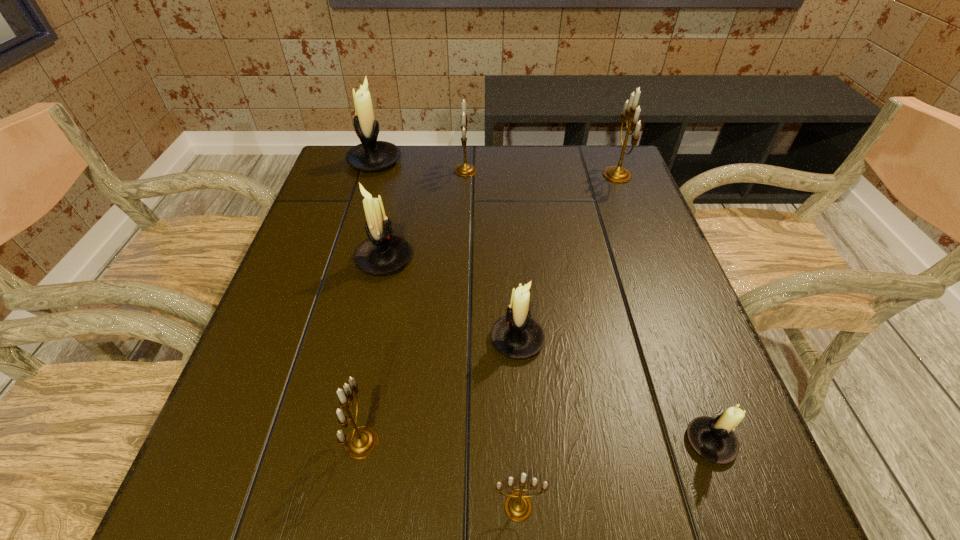
Identify the location of free space between the rightmost white candle holder and the nearest candelabrum. (614, 474).

Identify the location of vacant area that lies between the biggest white candle holder and the rightmost white candle holder. This screenshot has height=540, width=960. (542, 302).

The width and height of the screenshot is (960, 540). I want to click on free area in between the second gold candelabrum from right to left and the biggest gold candelabrum, so click(x=567, y=341).

You are a GUI agent. You are given a task and a screenshot of the screen. Output one action in this format:
    pyautogui.click(x=<x>, y=<y>)
    Task: Click on the blank region between the farthest white candle holder and the rightmost gold candelabrum
    This screenshot has width=960, height=540.
    Given the screenshot: What is the action you would take?
    pyautogui.click(x=496, y=168)

I want to click on blank region between the third smallest white candle holder and the biggest gold candelabrum, so click(x=500, y=217).

I want to click on free space between the biggest white candle holder and the second gold candelabrum from left to right, so click(420, 166).

Locate an element on the screen. empty space between the third farthest gold candelabrum and the third gold candelabrum from left to right is located at coordinates (440, 475).

The height and width of the screenshot is (540, 960). What are the coordinates of `free space between the fourth nearest candelabrum and the farthest white candle holder` in the screenshot? It's located at (445, 251).

Select which object is the second closest to the rightmost white candle holder. Please provide its 2D coordinates. Your answer should be formatted as a tuple, i.e. [(x, y)], where the tuple contains the x and y coordinates of a point satisfying the conditions above.

[(518, 506)]

Identify which object is the third closest to the fourth farthest object. Please provide its 2D coordinates. Your answer should be formatted as a tuple, i.e. [(x, y)], where the tuple contains the x and y coordinates of a point satisfying the conditions above.

[(370, 155)]